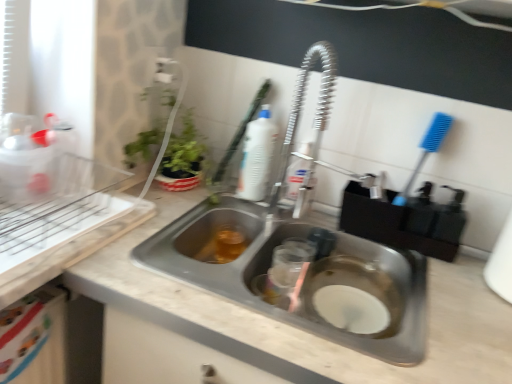
Where is `vacant space to the right of translucent plastic bottle at center, positioned as the 2th cleaning product in left-to-right order`? The width and height of the screenshot is (512, 384). vacant space to the right of translucent plastic bottle at center, positioned as the 2th cleaning product in left-to-right order is located at coordinates (339, 216).